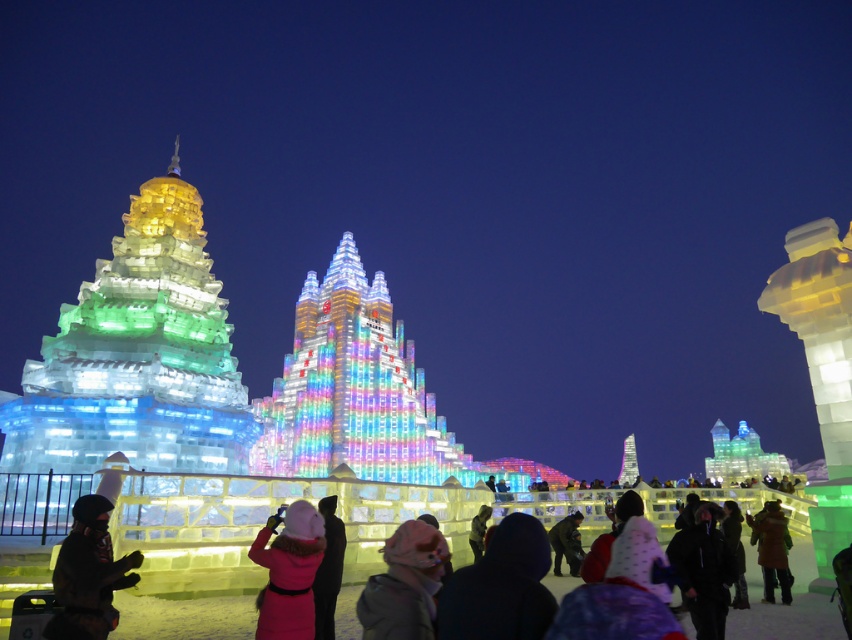
Which is behind, point (413, 618) or point (766, 512)?

The point (766, 512) is more distant.

Is point (436, 554) farther from camera compared to point (758, 556)?

No, it is not.

Locate an element on the screen. The image size is (852, 640). fuzzy pink hat at center is located at coordinates (404, 584).

Does point (417, 612) come in front of point (712, 525)?

Yes, it is in front of point (712, 525).

Is fuzzy pink hat at center further to the viewer compared to black matte jacket at center?

No, fuzzy pink hat at center is in front of black matte jacket at center.

Is point (417, 593) less distant than point (718, 598)?

That is True.

Locate an element on the screen. This screenshot has width=852, height=640. fuzzy pink hat at center is located at coordinates (404, 584).

The width and height of the screenshot is (852, 640). Describe the element at coordinates (288, 572) in the screenshot. I see `pink woolen hat at center` at that location.

Between point (286, 609) and point (722, 566), which one is positioned in front?

Point (286, 609) is more forward.

Which is behind, point (309, 634) or point (694, 620)?

Point (694, 620)

Locate an element on the screen. Image resolution: width=852 pixels, height=640 pixels. pink woolen hat at center is located at coordinates (288, 572).